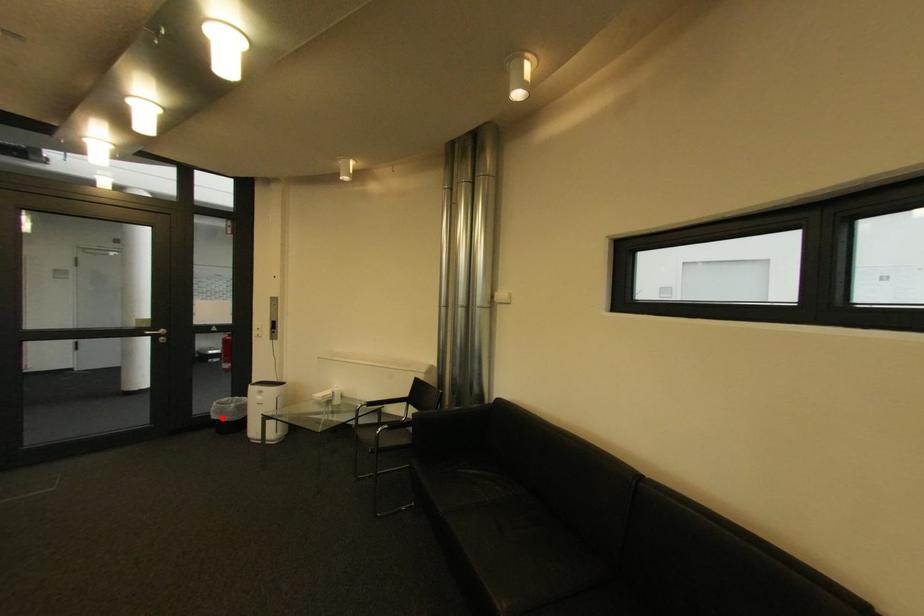
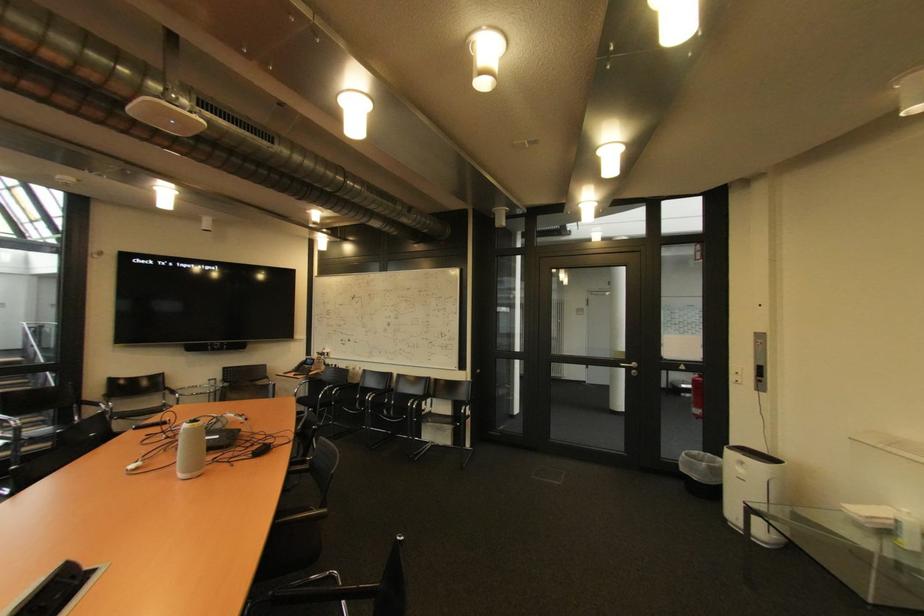
Question: I am providing you with two images of the same scene from different viewpoints. A red point is shown in image1. For the corresponding object point in image2, is it positioned nearer or farther from the camera?

Choices:
 (A) Nearer
 (B) Farther

Answer: (A)